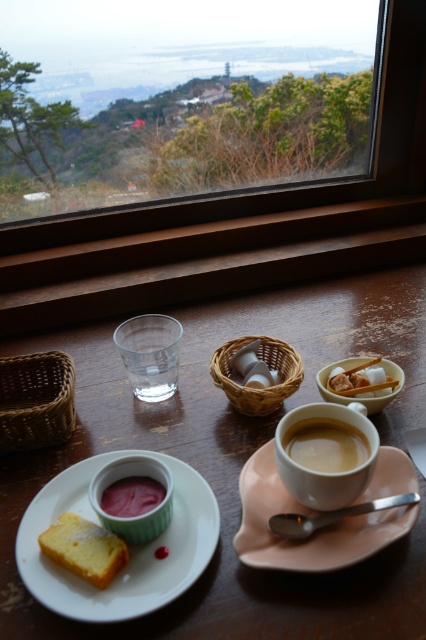
Is point (195, 387) positioned before point (150, 499)?

No, (195, 387) is further to viewer.

Which is in front, point (342, 330) or point (137, 512)?

Positioned in front is point (137, 512).

I want to click on wooden table at center, so click(236, 461).

Where is `wooden table at center`? wooden table at center is located at coordinates (236, 461).

Which is more to the right, wooden table at center or woven straw basket at center?

Positioned to the right is woven straw basket at center.

Which is behind, point (414, 568) or point (296, 381)?

Positioned behind is point (296, 381).

Find the location of a particular element. wooden table at center is located at coordinates (236, 461).

Is white ceramic plate at lower left shorter than woven straw basket at center?

No, white ceramic plate at lower left is not shorter than woven straw basket at center.

From the picture: Is white ceramic plate at lower left wider than woven straw basket at center?

Correct, the width of white ceramic plate at lower left exceeds that of woven straw basket at center.

You are a GUI agent. You are given a task and a screenshot of the screen. Output one action in this format:
    pyautogui.click(x=<x>, y=<y>)
    Task: Click on the white ceramic plate at lower left
    This screenshot has height=640, width=426.
    Given the screenshot: What is the action you would take?
    pyautogui.click(x=132, y=548)

This screenshot has width=426, height=640. What are the coordinates of `white ceramic plate at lower left` in the screenshot? It's located at (132, 548).